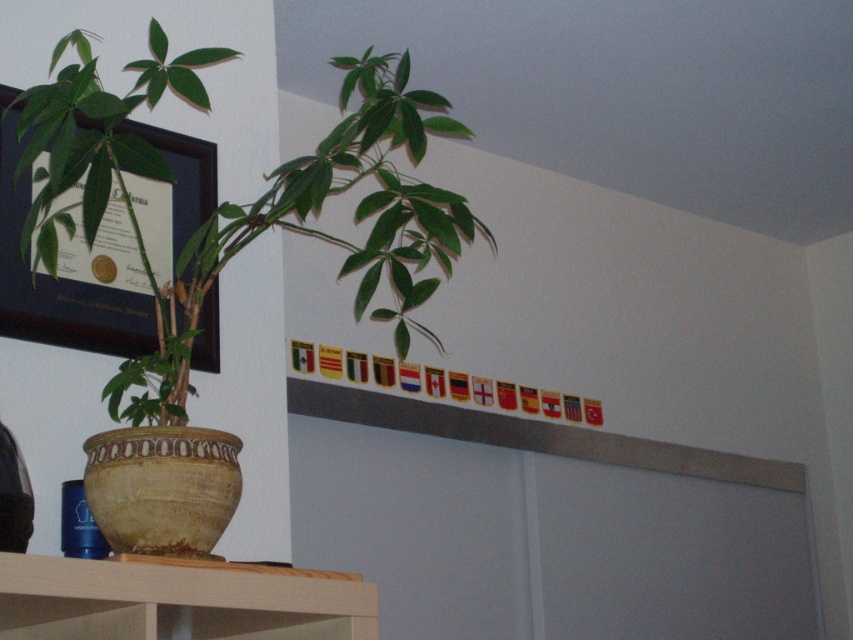
You are standing in the room and see two points marked on the wall. The first point is at coordinates point (358,582) and the second point is at coordinates point (173,205). Which point is closer to you?

Point (358,582) is in front of point (173,205), so the first point is closer to you.

You are organizing a small party in the room and want to hang a decorative ribbon between the green matte plant at left and the matte black frame at upper left. Based on their positions, will the ribbon need to be angled upwards or downwards to connect them?

The green matte plant at left is above the matte black frame at upper left, so the ribbon would need to be angled downwards to connect them.

You are standing in front of the room corner and want to reach both the green matte plant at left and the wooden at lower left. Which object should you move closer to first?

The green matte plant at left is closer to you than the wooden at lower left, so you should move toward the green matte plant at left first.